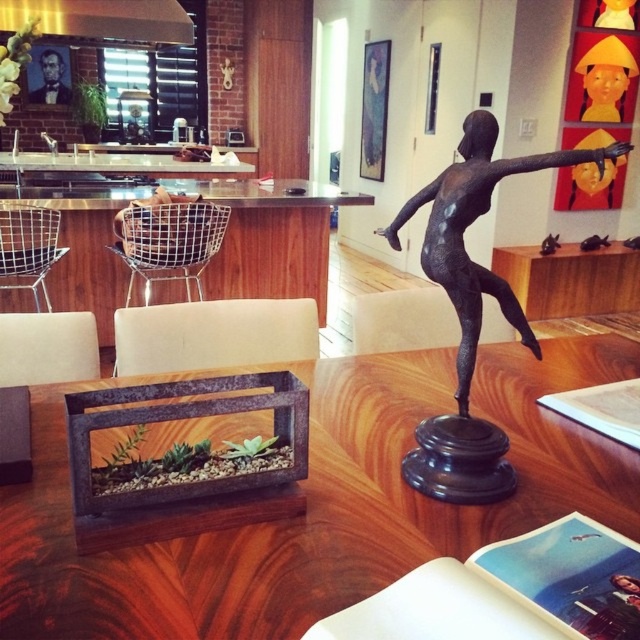
You are standing in the dining area and want to place a small vase on the table. The vase requires a spot that is exactly 6 feet away from you. Is the point at coordinates point (x=246, y=353) suitable for placing the vase?

The distance of point (x=246, y=353) from viewer is 5.95 feet, so it is almost exactly 6 feet away. The point at coordinates point (x=246, y=353) is suitable for placing the vase.

You are sitting in a wire mesh chair at left and want to place a book on the wooden table at center. Can you easily reach the table from your current position?

The wooden table at center is positioned under the wire mesh chair at left, so you can easily reach the table from your current position.

You are hosting a dinner party and need to seat 6 guests. The wooden table at center can accommodate 4 people comfortably. Can the wire mesh chair at left be placed around the table to seat everyone?

The wooden table at center is larger in size than the wire mesh chair at left, but since the table can only accommodate 4 guests and you need to seat 6, you would need additional seating beyond the wire mesh chair at left to accommodate everyone.